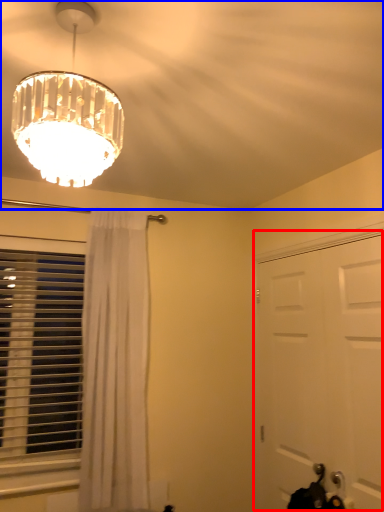
Question: Among these objects, which one is farthest to the camera, door (highlighted by a red box) or fan (highlighted by a blue box)?

Choices:
 (A) door
 (B) fan

Answer: (A)